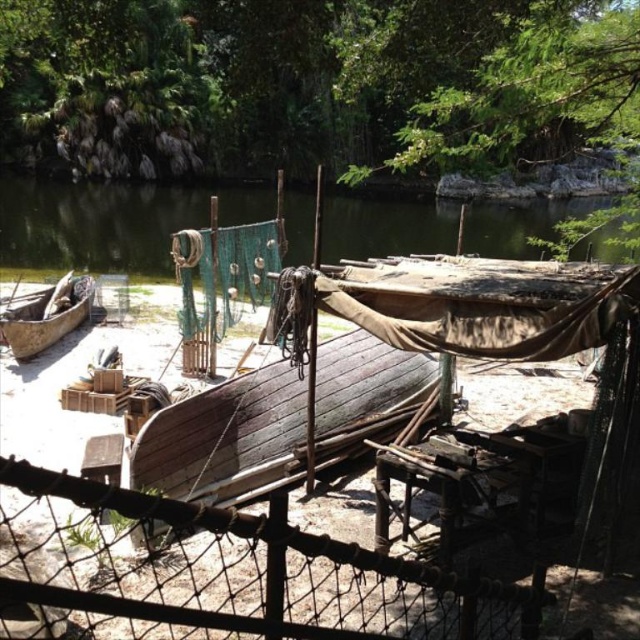
Which is more to the right, wire mesh fence at center or dark brown wooden boat at center?

From the viewer's perspective, wire mesh fence at center appears more on the right side.

Measure the distance between wire mesh fence at center and camera.

wire mesh fence at center is 2.46 meters away from camera.

This screenshot has height=640, width=640. In order to click on wire mesh fence at center in this screenshot , I will do click(227, 573).

Is rusty wire mesh at center thinner than brown wooden canoe at left?

Yes, rusty wire mesh at center is thinner than brown wooden canoe at left.

Identify the location of rusty wire mesh at center. The image size is (640, 640). (218, 573).

Between point (266, 628) and point (72, 285), which one is positioned in front?

Point (266, 628)

Image resolution: width=640 pixels, height=640 pixels. What are the coordinates of `rusty wire mesh at center` in the screenshot? It's located at (218, 573).

Does dark brown wooden boat at center have a lesser width compared to brown wooden canoe at left?

In fact, dark brown wooden boat at center might be wider than brown wooden canoe at left.

Does dark brown wooden boat at center appear over brown wooden canoe at left?

Incorrect, dark brown wooden boat at center is not positioned above brown wooden canoe at left.

The image size is (640, 640). I want to click on dark brown wooden boat at center, so click(227, 442).

You are a GUI agent. You are given a task and a screenshot of the screen. Output one action in this format:
    pyautogui.click(x=<x>, y=<y>)
    Task: Click on the dark brown wooden boat at center
    Image resolution: width=640 pixels, height=640 pixels.
    Given the screenshot: What is the action you would take?
    pyautogui.click(x=227, y=442)